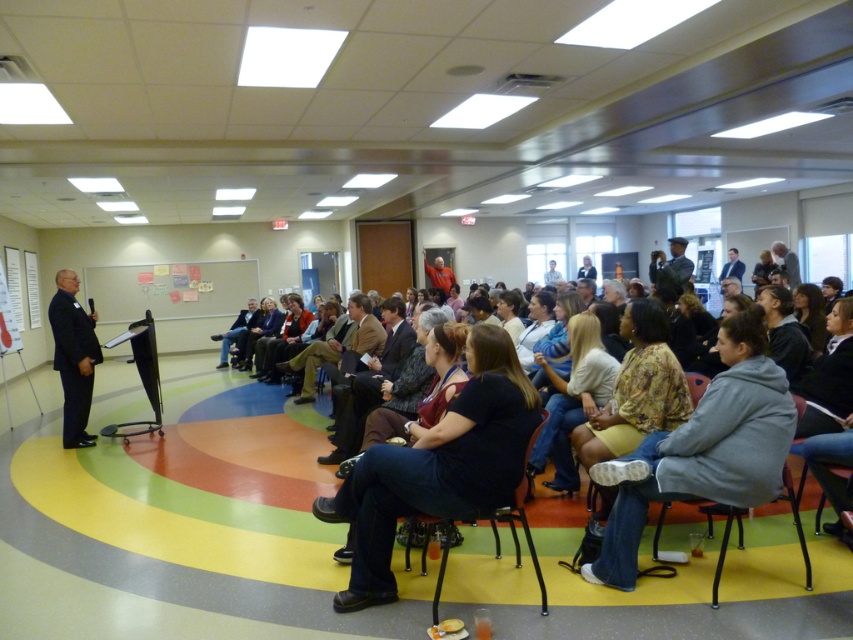
Question: Which point is closer to the camera?

Choices:
 (A) floral-patterned blouse at center
 (B) dark suit at left
 (C) black plastic chair at center
 (D) light brown suit at center

Answer: (C)

Question: Can you confirm if dark brown leather jacket at center is positioned to the left of gray fabric chair at lower right?

Choices:
 (A) yes
 (B) no

Answer: (A)

Question: Is floral-patterned blouse at center bigger than dark suit at left?

Choices:
 (A) yes
 (B) no

Answer: (A)

Question: Which point is closer to the camera?

Choices:
 (A) (412, 480)
 (B) (730, 273)
 (C) (79, 400)

Answer: (A)

Question: Does dark gray uniform at center appear on the left side of gray fabric jacket at upper right?

Choices:
 (A) yes
 (B) no

Answer: (A)

Question: Which point is farther from the camera taking this photo?

Choices:
 (A) 602,433
 (B) 614,563
 (C) 514,442

Answer: (A)